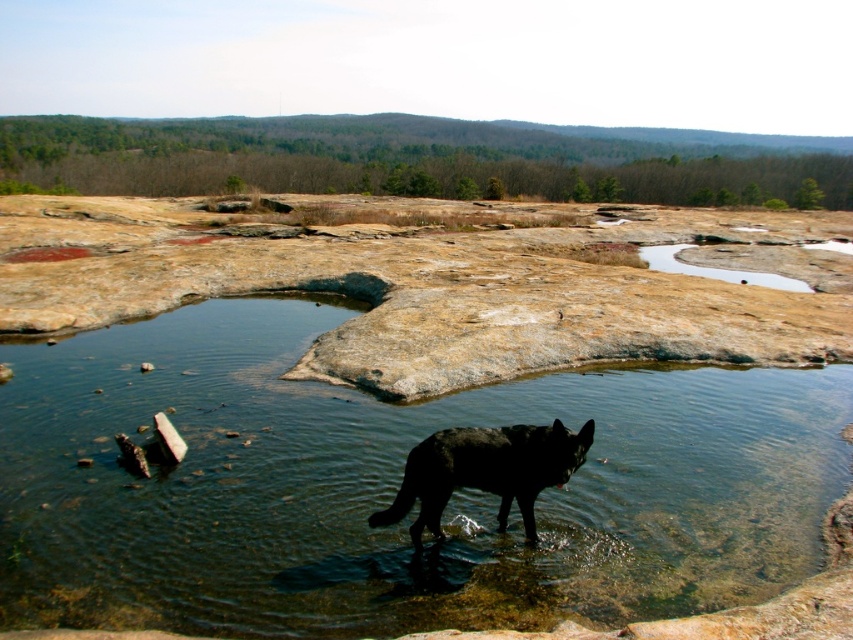
Locate an element on the screen. The height and width of the screenshot is (640, 853). clear water at center is located at coordinates (389, 486).

Does clear water at center have a greater width compared to black fur dog at lower center?

Indeed, clear water at center has a greater width compared to black fur dog at lower center.

At what (x,y) coordinates should I click in order to perform the action: click on clear water at center. Please return your answer as a coordinate pair (x, y). The width and height of the screenshot is (853, 640). Looking at the image, I should click on (389, 486).